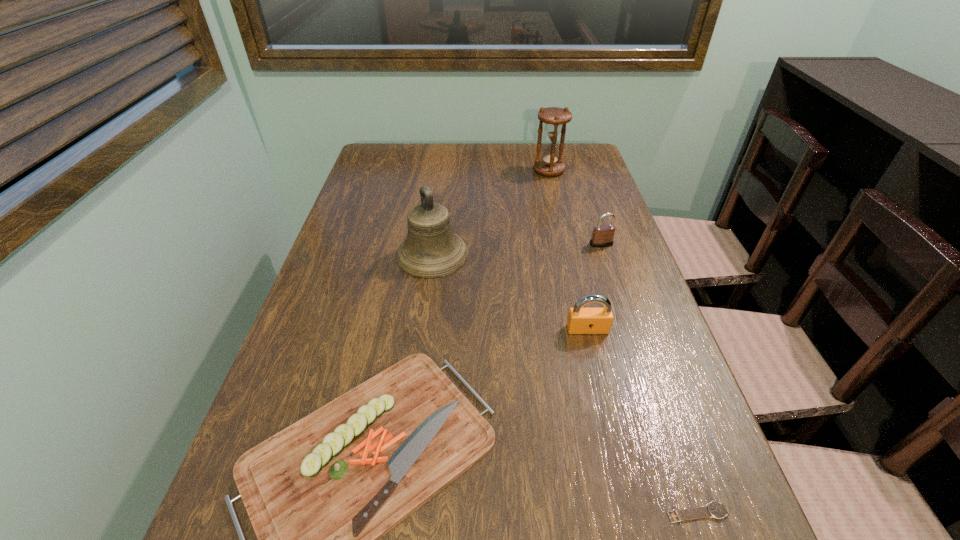
You are a GUI agent. You are given a task and a screenshot of the screen. Output one action in this format:
    pyautogui.click(x=<x>, y=<y>)
    Task: Click on the vacant area situated 0.110m on the left of the watch
    This screenshot has width=960, height=540.
    Given the screenshot: What is the action you would take?
    pyautogui.click(x=591, y=512)

You are a GUI agent. You are given a task and a screenshot of the screen. Output one action in this format:
    pyautogui.click(x=<x>, y=<y>)
    Task: Click on the object positioned at the far edge
    The image size is (960, 540).
    Given the screenshot: What is the action you would take?
    pyautogui.click(x=550, y=164)

At what (x,y) coordinates should I click in order to perform the action: click on hourglass present at the right edge. Please return your answer as a coordinate pair (x, y). Looking at the image, I should click on (550, 164).

I want to click on watch at the right edge, so click(x=714, y=509).

The image size is (960, 540). I want to click on object that is positioned at the far right corner, so [550, 164].

Where is `blank space at the far edge of the desktop`? blank space at the far edge of the desktop is located at coordinates (465, 173).

The height and width of the screenshot is (540, 960). I want to click on vacant space at the left edge of the desktop, so click(332, 265).

In the image, there is a desktop. Where is `vacant region at the right edge`? vacant region at the right edge is located at coordinates (586, 284).

Find the location of a particular element. The image size is (960, 540). free space at the far right corner of the desktop is located at coordinates pos(585,158).

This screenshot has width=960, height=540. Identify the location of vacant space that's between the fourth farthest object and the bell. (510, 292).